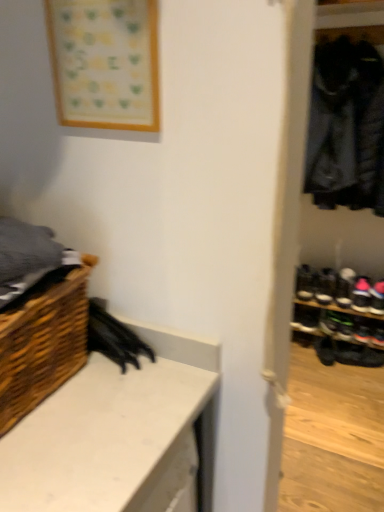
Question: Is black leather shoe at right, which is the 3th footwear from top to bottom, positioned beyond the bounds of black leather shoe at lower right, acting as the 4th footwear starting from the top?

Choices:
 (A) yes
 (B) no

Answer: (A)

Question: Are black leather shoe at right, the second footwear ordered from the bottom, and black leather shoe at lower right, acting as the 4th footwear starting from the top, making contact?

Choices:
 (A) yes
 (B) no

Answer: (B)

Question: From a real-world perspective, does black leather shoe at right, the second footwear ordered from the bottom, sit lower than black leather shoe at lower right, acting as the 4th footwear starting from the top?

Choices:
 (A) yes
 (B) no

Answer: (B)

Question: Does black leather shoe at right, which is the 3th footwear from top to bottom, appear on the right side of black leather shoe at lower right, acting as the 4th footwear starting from the top?

Choices:
 (A) no
 (B) yes

Answer: (B)

Question: Is black leather shoe at lower right, acting as the 4th footwear starting from the top, a part of black leather shoe at right, which is the 3th footwear from top to bottom?

Choices:
 (A) no
 (B) yes

Answer: (A)

Question: Relative to wooden frame at upper left, is white matte counter at lower left in front or behind?

Choices:
 (A) front
 (B) behind

Answer: (A)

Question: Does point (107, 496) appear closer or farther from the camera than point (72, 49)?

Choices:
 (A) closer
 (B) farther

Answer: (A)

Question: From the image's perspective, is white matte counter at lower left above or below wooden frame at upper left?

Choices:
 (A) above
 (B) below

Answer: (B)

Question: Based on their positions, is white matte counter at lower left located to the left or right of wooden frame at upper left?

Choices:
 (A) right
 (B) left

Answer: (B)

Question: From the image's perspective, is woven wood basket at lower left above or below black suede shoe at lower right, the first footwear viewed from the top?

Choices:
 (A) above
 (B) below

Answer: (A)

Question: Considering the positions of woven wood basket at lower left and black suede shoe at lower right, the first footwear viewed from the top, in the image, is woven wood basket at lower left taller or shorter than black suede shoe at lower right, the first footwear viewed from the top,?

Choices:
 (A) tall
 (B) short

Answer: (A)

Question: Considering their positions, is woven wood basket at lower left located in front of or behind black suede shoe at lower right, the first footwear viewed from the top?

Choices:
 (A) front
 (B) behind

Answer: (A)

Question: Based on their sizes in the image, would you say woven wood basket at lower left is bigger or smaller than black suede shoe at lower right, the first footwear viewed from the top?

Choices:
 (A) big
 (B) small

Answer: (A)

Question: Is black leather shoe at right, the second footwear ordered from the bottom, bigger or smaller than black leather shoe at lower right, which appears as the first footwear when ordered from the bottom?

Choices:
 (A) big
 (B) small

Answer: (B)

Question: Is point coord(372,286) closer or farther from the camera than point coord(321,343)?

Choices:
 (A) closer
 (B) farther

Answer: (A)